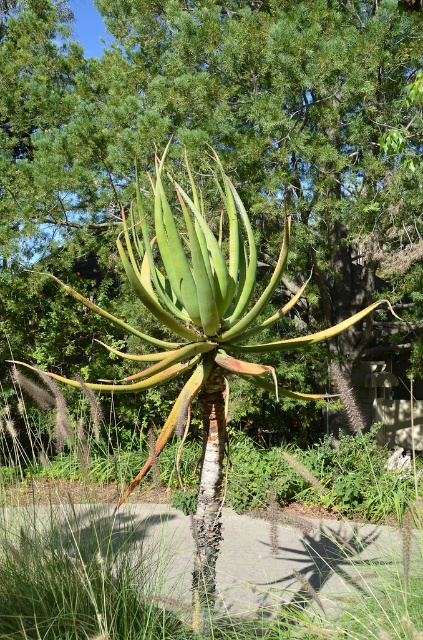
How much distance is there between green succulent at center and green grass at center?

They are 33.67 feet apart.

Can you confirm if green succulent at center is taller than green grass at center?

Correct, green succulent at center is much taller as green grass at center.

Is point (269, 182) less distant than point (47, 604)?

No, (269, 182) is further to viewer.

You are a GUI agent. You are given a task and a screenshot of the screen. Output one action in this format:
    pyautogui.click(x=<x>, y=<y>)
    Task: Click on the green succulent at center
    The width and height of the screenshot is (423, 640).
    Given the screenshot: What is the action you would take?
    pyautogui.click(x=206, y=148)